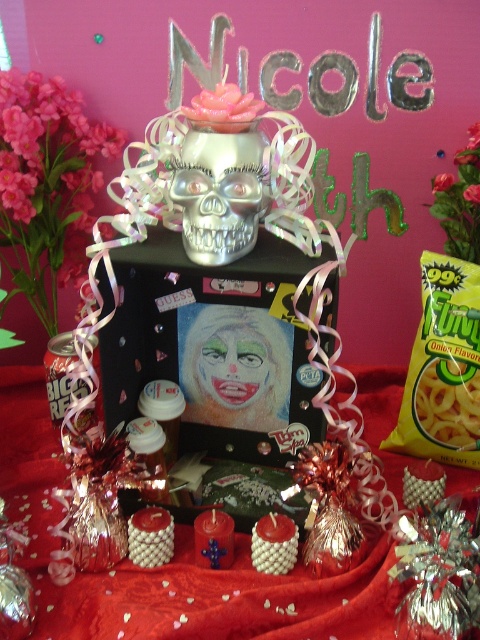
Which is more to the left, red satin tablecloth at center or silver metallic skull at center?

Positioned to the left is red satin tablecloth at center.

Does red satin tablecloth at center have a smaller size compared to silver metallic skull at center?

Incorrect, red satin tablecloth at center is not smaller in size than silver metallic skull at center.

Between point (155, 584) and point (241, 163), which one is positioned behind?

The point (155, 584) is behind.

The image size is (480, 640). Find the location of `red satin tablecloth at center`. red satin tablecloth at center is located at coordinates (169, 563).